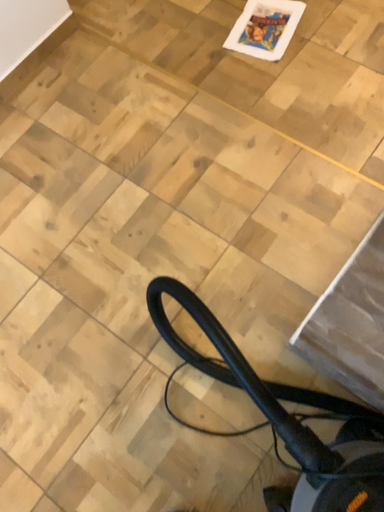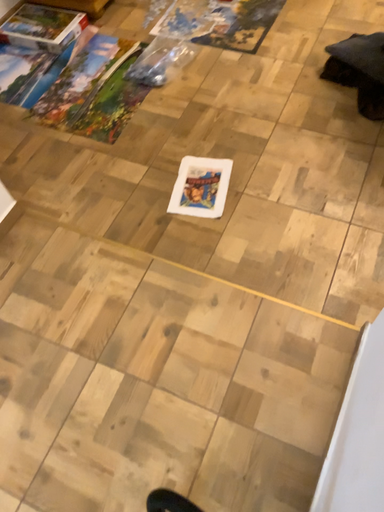
Question: How did the camera likely rotate when shooting the video?

Choices:
 (A) rotated upward
 (B) rotated downward

Answer: (A)